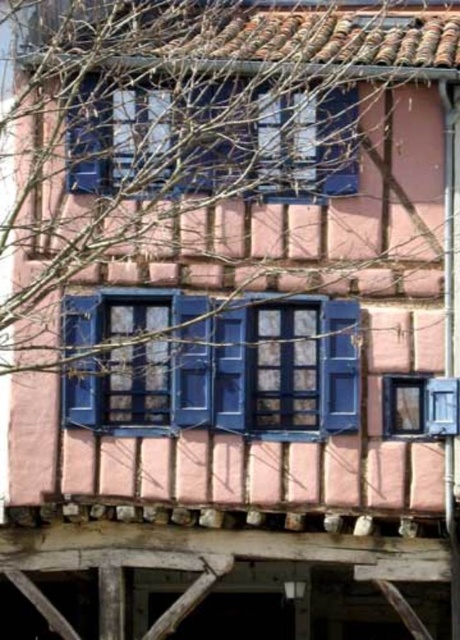
You are a painter who needs to measure the distance between the matte blue shutters at center and the pinkish red plastered facade. Can you confirm if the distance is more than 60 feet?

The matte blue shutters at center and the pinkish red plastered facade are 61.96 feet apart, so yes, the distance is more than 60 feet.

You are an architect designing a new building inspired by the traditional European style shown. You need to ensure that the matte blue shutters at center and the blue painted wood at upper center are proportionate. Which object should you make taller to maintain the design balance?

The matte blue shutters at center should be made taller than the blue painted wood at upper center to maintain the design balance, as the matte blue shutters at center already has a greater height compared to blue painted wood at upper center.

You are standing in front of a two story building with traditional European architecture. You see two points marked on the building. The first point is at coordinate point (200, 420) and the second is at coordinate point (132, 129). Which point is closer to you?

Point (200, 420) is closer to the camera than point (132, 129).